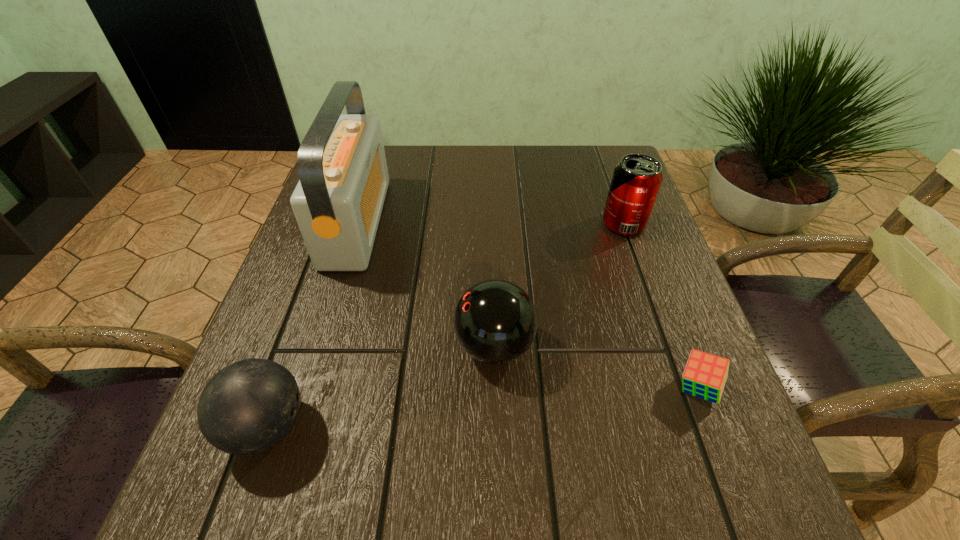
The image size is (960, 540). In order to click on the tallest object in this screenshot , I will do `click(338, 201)`.

Locate an element on the screen. The height and width of the screenshot is (540, 960). soda can is located at coordinates (636, 180).

At what (x,y) coordinates should I click in order to perform the action: click on the right bowling ball. Please return your answer as a coordinate pair (x, y). Looking at the image, I should click on (495, 321).

Locate an element on the screen. the farther bowling ball is located at coordinates (495, 321).

Where is `the nearer bowling ball`? The height and width of the screenshot is (540, 960). the nearer bowling ball is located at coordinates (249, 406).

Where is `cube`? The width and height of the screenshot is (960, 540). cube is located at coordinates click(x=705, y=375).

Image resolution: width=960 pixels, height=540 pixels. I want to click on blank space located on the front-facing side of the tallest object, so click(420, 222).

Identify the location of free point located on the back of the soda can. (609, 181).

Locate an element on the screen. The width and height of the screenshot is (960, 540). vacant space positioned on the surface of the farther bowling ball near the finger holes is located at coordinates (415, 346).

Locate an element on the screen. The width and height of the screenshot is (960, 540). vacant space situated 0.210m on the surface of the farther bowling ball near the finger holes is located at coordinates (334, 346).